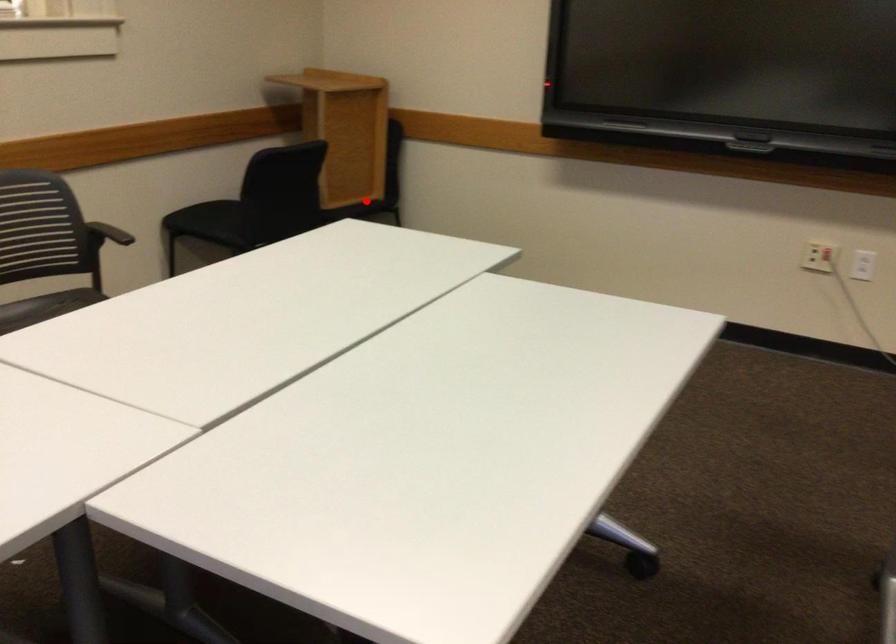
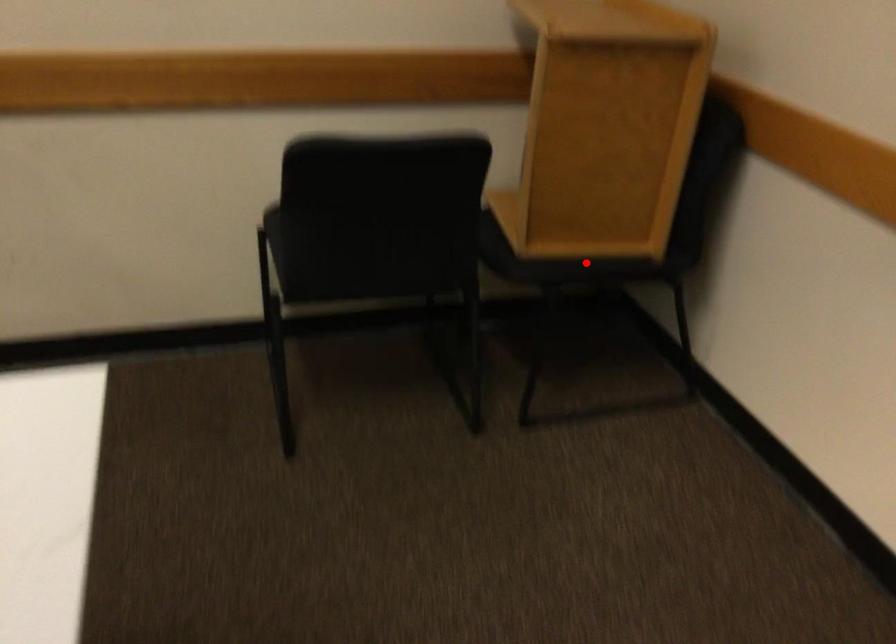
I am providing you with two images of the same scene from different viewpoints. A red point is marked on the first image and another point is marked on the second image. Does the point marked in image1 correspond to the same location as the one in image2?

Yes